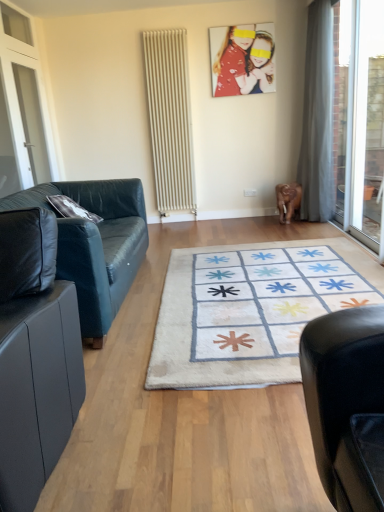
The image size is (384, 512). What do you see at coordinates (243, 59) in the screenshot?
I see `matte plastic photo frame at upper center` at bounding box center [243, 59].

You are a GUI agent. You are given a task and a screenshot of the screen. Output one action in this format:
    pyautogui.click(x=<x>, y=<y>)
    Task: Click on the gray fabric curtain at right
    The width and height of the screenshot is (384, 512).
    Given the screenshot: What is the action you would take?
    click(318, 118)

In order to face gray fabric curtain at right, should I rotate leftwards or rightwards?

To face it directly, rotate right by 16.030 degrees.

At what (x,y) coordinates should I click in order to perform the action: click on white glass screen door at left. Please return your answer as a coordinate pair (x, y). The width and height of the screenshot is (384, 512). Looking at the image, I should click on (27, 118).

Measure the distance between white glass screen door at left and camera.

They are 3.65 meters apart.

What do you see at coordinates (249, 311) in the screenshot? I see `white soft rug at center` at bounding box center [249, 311].

Describe the element at coordinates (170, 119) in the screenshot. This screenshot has height=512, width=384. I see `beige textured radiator at center` at that location.

This screenshot has height=512, width=384. I want to click on matte plastic photo frame at upper center, so click(x=243, y=59).

Considering the sizes of objects black leather couch at left, positioned as the 1th studio couch in back-to-front order, and beige textured radiator at center in the image provided, who is taller, black leather couch at left, positioned as the 1th studio couch in back-to-front order, or beige textured radiator at center?

With more height is beige textured radiator at center.

Is black leather couch at left, which ranks as the 2th studio couch in front-to-back order, smaller than beige textured radiator at center?

No.

How many degrees apart are the facing directions of black leather couch at left, which ranks as the 2th studio couch in front-to-back order, and beige textured radiator at center?

88.5 degrees.

Which is behind, point (5, 197) or point (181, 124)?

The point (181, 124) is more distant.

From the image's perspective, relative to white soft rug at center, is white glass screen door at left above or below?

white glass screen door at left is above white soft rug at center.

How far apart are white glass screen door at left and white soft rug at center?

white glass screen door at left and white soft rug at center are 2.37 meters apart.

Are white glass screen door at left and white soft rug at center beside each other?

white glass screen door at left is not next to white soft rug at center, and they're not touching.

Is beige textured radiator at center positioned far away from white soft rug at center?

Yes, beige textured radiator at center is far from white soft rug at center.

Between beige textured radiator at center and white soft rug at center, which one has larger width?

white soft rug at center is wider.

Does point (180, 174) come closer to viewer compared to point (237, 344)?

No, (180, 174) is behind (237, 344).

Which object is further away from the camera, beige textured radiator at center or white soft rug at center?

beige textured radiator at center.

Could you measure the distance between black leather couch at left, arranged as the second studio couch when viewed from the back, and white glass screen door at left?

black leather couch at left, arranged as the second studio couch when viewed from the back, is 9.84 feet away from white glass screen door at left.

Which of these two, black leather couch at left, the 1th studio couch viewed from the front, or white glass screen door at left, is bigger?

Bigger between the two is black leather couch at left, the 1th studio couch viewed from the front.

From a real-world perspective, is black leather couch at left, arranged as the second studio couch when viewed from the back, on white glass screen door at left?

No, from a real-world perspective, black leather couch at left, arranged as the second studio couch when viewed from the back, is not on top of white glass screen door at left.

Would you say transparent glass door at right is outside matte plastic photo frame at upper center?

Yes.

Are transparent glass door at right and matte plastic photo frame at upper center beside each other?

transparent glass door at right is not next to matte plastic photo frame at upper center, and they're not touching.

Is transparent glass door at right turned away from matte plastic photo frame at upper center?

No, matte plastic photo frame at upper center is not at the back of transparent glass door at right.

Where is `window screen below the matte plastic photo frame at upper center (from the image's perspective)`? window screen below the matte plastic photo frame at upper center (from the image's perspective) is located at coordinates (359, 119).

In the scene shown: From the image's perspective, would you say transparent glass door at right is positioned over beige textured radiator at center?

No.

The height and width of the screenshot is (512, 384). In order to click on window screen located on the right of beige textured radiator at center in this screenshot , I will do `click(359, 119)`.

Is transparent glass door at right located outside beige textured radiator at center?

transparent glass door at right lies outside beige textured radiator at center's area.

Is transparent glass door at right taller or shorter than beige textured radiator at center?

In the image, transparent glass door at right appears to be shorter than beige textured radiator at center.

Between black leather couch at left, positioned as the 1th studio couch in back-to-front order, and matte plastic photo frame at upper center, which one appears on the right side from the viewer's perspective?

matte plastic photo frame at upper center is more to the right.

Which object is wider, black leather couch at left, positioned as the 1th studio couch in back-to-front order, or matte plastic photo frame at upper center?

Wider between the two is black leather couch at left, positioned as the 1th studio couch in back-to-front order.

Does black leather couch at left, positioned as the 1th studio couch in back-to-front order, come in front of matte plastic photo frame at upper center?

Yes.

In terms of size, does black leather couch at left, positioned as the 1th studio couch in back-to-front order, appear bigger or smaller than matte plastic photo frame at upper center?

In the image, black leather couch at left, positioned as the 1th studio couch in back-to-front order, appears to be larger than matte plastic photo frame at upper center.

Identify the location of radiator above the black leather couch at left, positioned as the 1th studio couch in back-to-front order (from the image's perspective). The height and width of the screenshot is (512, 384). (170, 119).

What are the coordinates of `mat in front of the white glass screen door at left` in the screenshot? It's located at (249, 311).

When comparing their distances from white glass screen door at left, does matte plastic photo frame at upper center or black leather couch at left, which ranks as the 2th studio couch in front-to-back order, seem further?

matte plastic photo frame at upper center is further to white glass screen door at left.

Considering their positions, is beige textured radiator at center positioned further to transparent glass door at right than gray fabric curtain at right?

beige textured radiator at center is further to transparent glass door at right.

Based on their spatial positions, is beige textured radiator at center or transparent glass door at right closer to white soft rug at center?

transparent glass door at right.

Looking at the image, which one is located further to white glass screen door at left, black leather couch at left, which ranks as the 2th studio couch in front-to-back order, or matte plastic photo frame at upper center?

matte plastic photo frame at upper center.

Which object lies nearer to the anchor point white glass screen door at left, beige textured radiator at center or black leather couch at left, positioned as the 1th studio couch in back-to-front order?

Based on the image, black leather couch at left, positioned as the 1th studio couch in back-to-front order, appears to be nearer to white glass screen door at left.

Based on their spatial positions, is black leather couch at left, arranged as the second studio couch when viewed from the back, or beige textured radiator at center further from gray fabric curtain at right?

Based on the image, black leather couch at left, arranged as the second studio couch when viewed from the back, appears to be further to gray fabric curtain at right.

Based on the photo, from the image, which object appears to be farther from white soft rug at center, transparent glass door at right or gray fabric curtain at right?

The object further to white soft rug at center is gray fabric curtain at right.

When comparing their distances from gray fabric curtain at right, does white glass screen door at left or black leather couch at left, the 1th studio couch viewed from the front, seem closer?

white glass screen door at left is closer to gray fabric curtain at right.

Locate an element on the screen. curtain positioned between black leather couch at left, which ranks as the 2th studio couch in front-to-back order, and matte plastic photo frame at upper center from near to far is located at coordinates (318, 118).

Where is `picture frame between white glass screen door at left and transparent glass door at right in the horizontal direction`? This screenshot has width=384, height=512. picture frame between white glass screen door at left and transparent glass door at right in the horizontal direction is located at coordinates (243, 59).

I want to click on radiator between black leather couch at left, positioned as the 1th studio couch in back-to-front order, and matte plastic photo frame at upper center in the front-back direction, so click(x=170, y=119).

What are the coordinates of `window screen between white soft rug at center and matte plastic photo frame at upper center along the z-axis` in the screenshot? It's located at (359, 119).